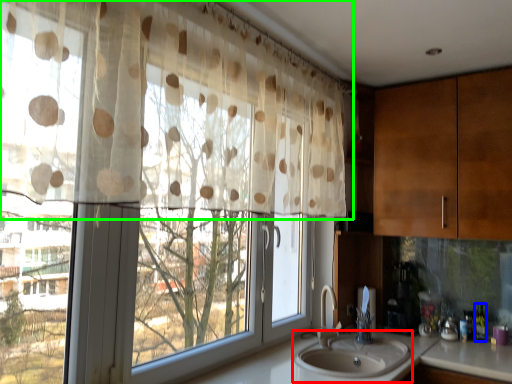
Question: Which object is the farthest from sink (highlighted by a red box)? Choose among these: bottle (highlighted by a blue box) or curtain (highlighted by a green box).

Choices:
 (A) bottle
 (B) curtain

Answer: (B)